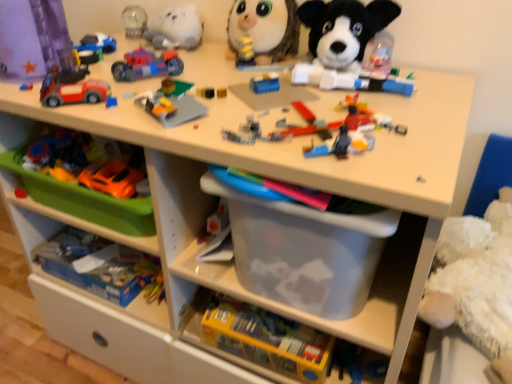
Question: Is yellow striped plush at upper center, arranged as the ninth toy when ordered from the bottom, facing away from matte plastic toy car at upper left, the eighth toy when ordered from bottom to top?

Choices:
 (A) no
 (B) yes

Answer: (A)

Question: Is yellow striped plush at upper center, arranged as the ninth toy when ordered from the bottom, taller than matte plastic toy car at upper left, the second toy from the top?

Choices:
 (A) no
 (B) yes

Answer: (B)

Question: From a real-world perspective, is yellow striped plush at upper center, arranged as the ninth toy when ordered from the bottom, under matte plastic toy car at upper left, the eighth toy when ordered from bottom to top?

Choices:
 (A) yes
 (B) no

Answer: (B)

Question: Is yellow striped plush at upper center, arranged as the ninth toy when ordered from the bottom, surrounding matte plastic toy car at upper left, the eighth toy when ordered from bottom to top?

Choices:
 (A) no
 (B) yes

Answer: (A)

Question: Can you confirm if yellow striped plush at upper center, marked as the first toy in a top-to-bottom arrangement, is smaller than matte plastic toy car at upper left, the second toy from the top?

Choices:
 (A) yes
 (B) no

Answer: (B)

Question: From the image's perspective, does yellow striped plush at upper center, marked as the first toy in a top-to-bottom arrangement, appear higher than matte plastic toy car at upper left, the second toy from the top?

Choices:
 (A) yes
 (B) no

Answer: (A)

Question: Does green plastic tray at lower left have a lesser height compared to translucent plastic bricks at center, which is counted as the fourth toy, starting from the bottom?

Choices:
 (A) no
 (B) yes

Answer: (A)

Question: From the image's perspective, is green plastic tray at lower left located beneath translucent plastic bricks at center, arranged as the 6th toy when viewed from the top?

Choices:
 (A) yes
 (B) no

Answer: (A)

Question: From the image's perspective, would you say green plastic tray at lower left is positioned over translucent plastic bricks at center, arranged as the 6th toy when viewed from the top?

Choices:
 (A) no
 (B) yes

Answer: (A)

Question: Could you tell me if green plastic tray at lower left is facing translucent plastic bricks at center, arranged as the 6th toy when viewed from the top?

Choices:
 (A) yes
 (B) no

Answer: (B)

Question: Considering the relative positions of green plastic tray at lower left and translucent plastic bricks at center, which is counted as the fourth toy, starting from the bottom, in the image provided, is green plastic tray at lower left in front of translucent plastic bricks at center, which is counted as the fourth toy, starting from the bottom,?

Choices:
 (A) no
 (B) yes

Answer: (A)

Question: Is green plastic tray at lower left touching translucent plastic bricks at center, arranged as the 6th toy when viewed from the top?

Choices:
 (A) yes
 (B) no

Answer: (B)

Question: Can you confirm if orange matte car at left, which appears as the 3th toy when ordered from the bottom, is positioned to the left of matte plastic car at upper left, which is the fifth toy from top to bottom?

Choices:
 (A) no
 (B) yes

Answer: (A)